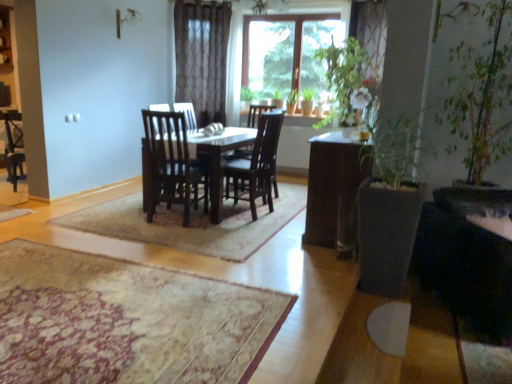
Question: Is metallic silver lamp at upper center at the left side of matte white cabinet at upper left?

Choices:
 (A) yes
 (B) no

Answer: (B)

Question: From the image's perspective, is metallic silver lamp at upper center over matte white cabinet at upper left?

Choices:
 (A) yes
 (B) no

Answer: (B)

Question: Is metallic silver lamp at upper center completely or partially outside of matte white cabinet at upper left?

Choices:
 (A) yes
 (B) no

Answer: (A)

Question: Is metallic silver lamp at upper center turned away from matte white cabinet at upper left?

Choices:
 (A) no
 (B) yes

Answer: (A)

Question: Is metallic silver lamp at upper center beside matte white cabinet at upper left?

Choices:
 (A) yes
 (B) no

Answer: (B)

Question: From a real-world perspective, is beige textured rug at center physically located above or below matte white cabinet at upper left?

Choices:
 (A) above
 (B) below

Answer: (B)

Question: Looking at the image, does beige textured rug at center seem bigger or smaller compared to matte white cabinet at upper left?

Choices:
 (A) big
 (B) small

Answer: (B)

Question: Does point (6, 316) appear closer or farther from the camera than point (13, 84)?

Choices:
 (A) closer
 (B) farther

Answer: (A)

Question: Would you say beige textured rug at center is inside or outside matte white cabinet at upper left?

Choices:
 (A) outside
 (B) inside

Answer: (A)

Question: Visually, is metallic silver lamp at upper center positioned to the left or to the right of matte white cabinet at upper left?

Choices:
 (A) right
 (B) left

Answer: (A)

Question: From the image's perspective, is metallic silver lamp at upper center located above or below matte white cabinet at upper left?

Choices:
 (A) above
 (B) below

Answer: (B)

Question: Considering the positions of point (136, 16) and point (3, 49), is point (136, 16) closer or farther from the camera than point (3, 49)?

Choices:
 (A) closer
 (B) farther

Answer: (B)

Question: From a real-world perspective, is metallic silver lamp at upper center physically located above or below matte white cabinet at upper left?

Choices:
 (A) above
 (B) below

Answer: (A)

Question: Is metallic silver lamp at upper center bigger or smaller than beige textured rug at center?

Choices:
 (A) small
 (B) big

Answer: (A)

Question: In the image, is metallic silver lamp at upper center positioned in front of or behind beige textured rug at center?

Choices:
 (A) behind
 (B) front

Answer: (A)